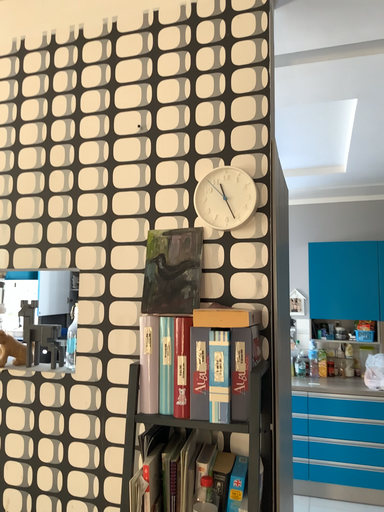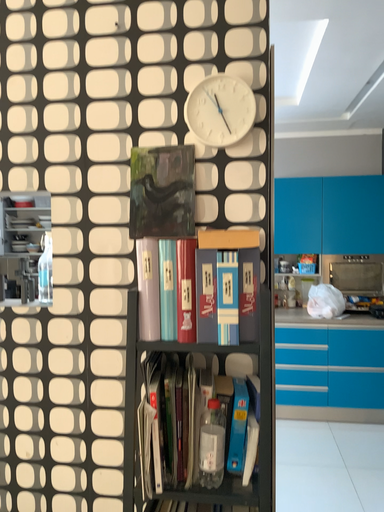
Question: Which way did the camera rotate in the video?

Choices:
 (A) rotated left
 (B) rotated right

Answer: (B)